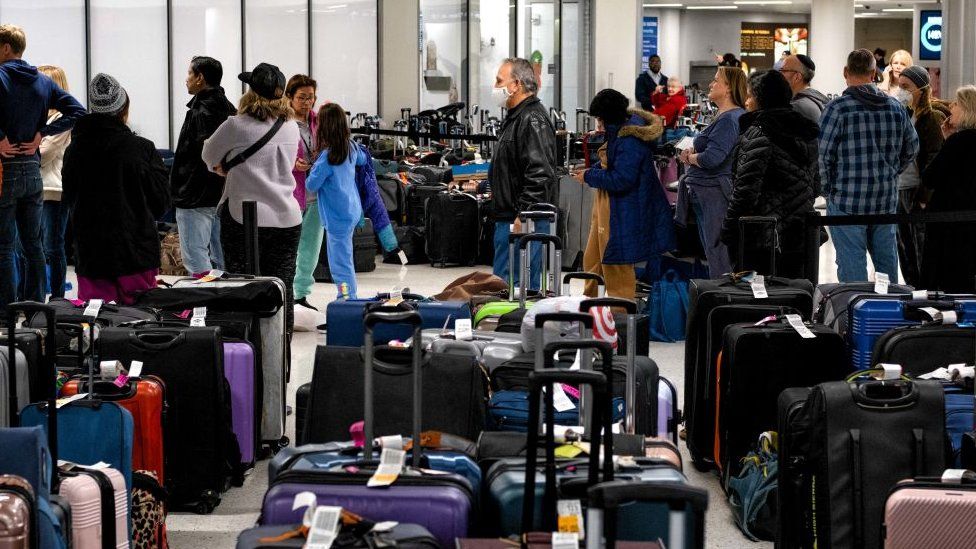
Locate an element on the screen. The width and height of the screenshot is (976, 549). windows is located at coordinates (53, 41), (102, 46), (204, 49), (269, 37), (337, 28), (436, 42), (481, 33), (540, 37), (576, 49).